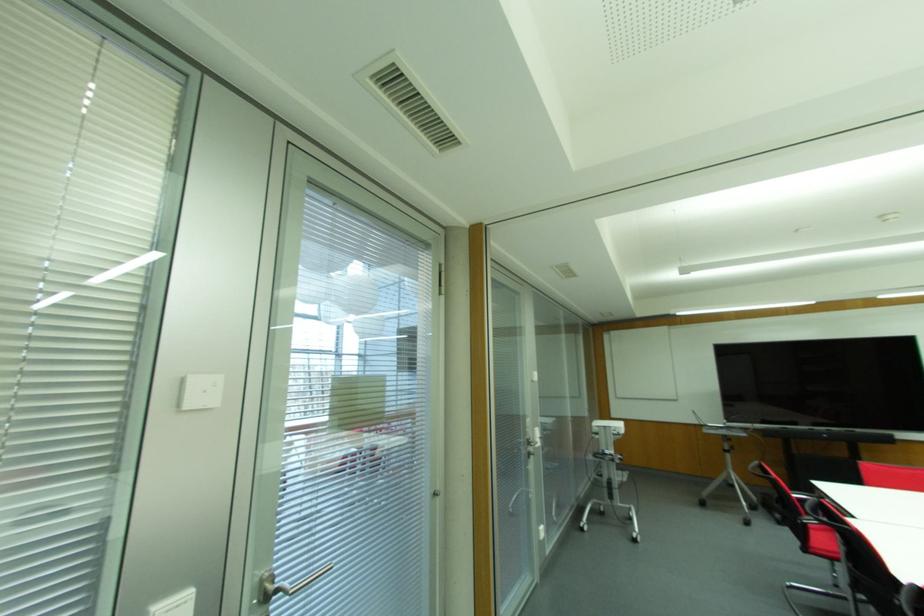
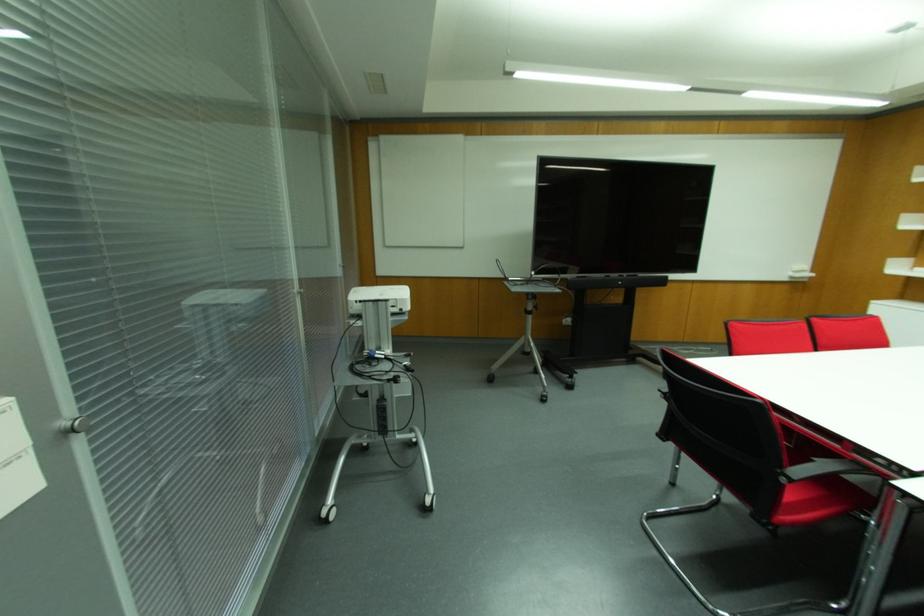
Where in the second image is the point corresponding to (618,426) from the first image?

(399, 294)